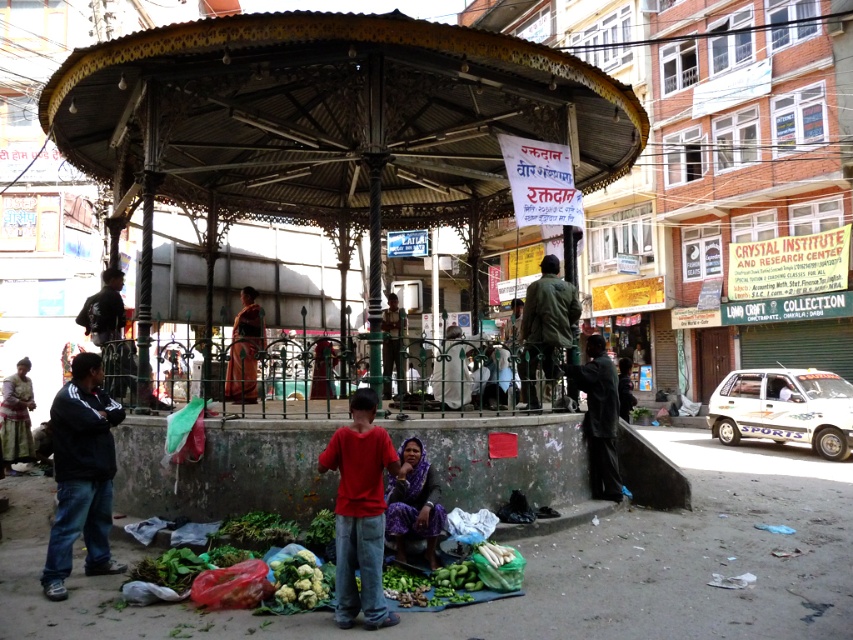
You are a tailor observing the green matte jacket at center and the green fabric skirt at lower left in the urban market scene. Which clothing item would require more fabric to make?

The green matte jacket at center would require more fabric to make since it is larger in size than the green fabric skirt at lower left.

You are a photographer trying to capture a shot of the dark green jacket at left and the green fabric skirt at lower left. Since you want to include both in the frame, which one should you focus on first to ensure both are in the shot?

The dark green jacket at left is located above the green fabric skirt at lower left, so focusing on the dark green jacket at left first would ensure both are in the frame.